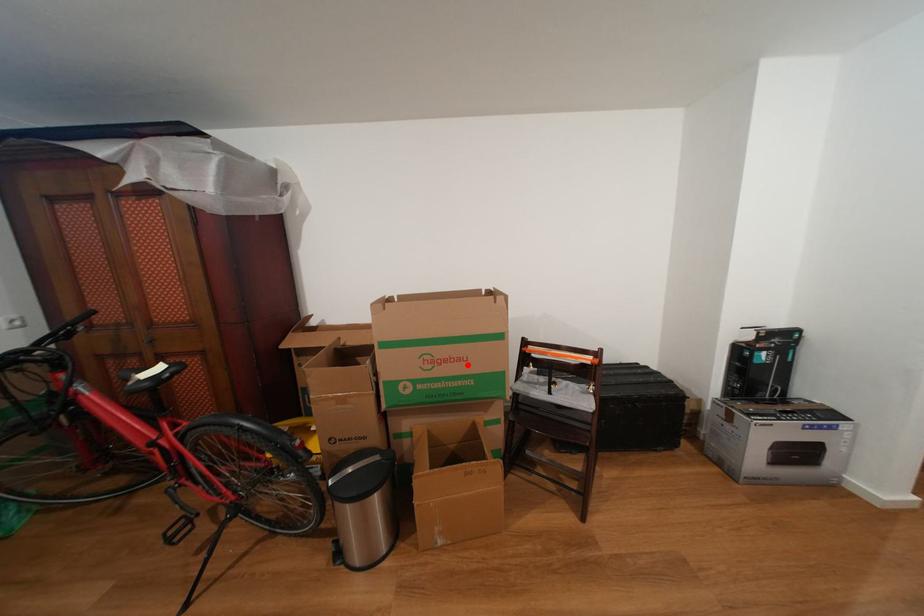
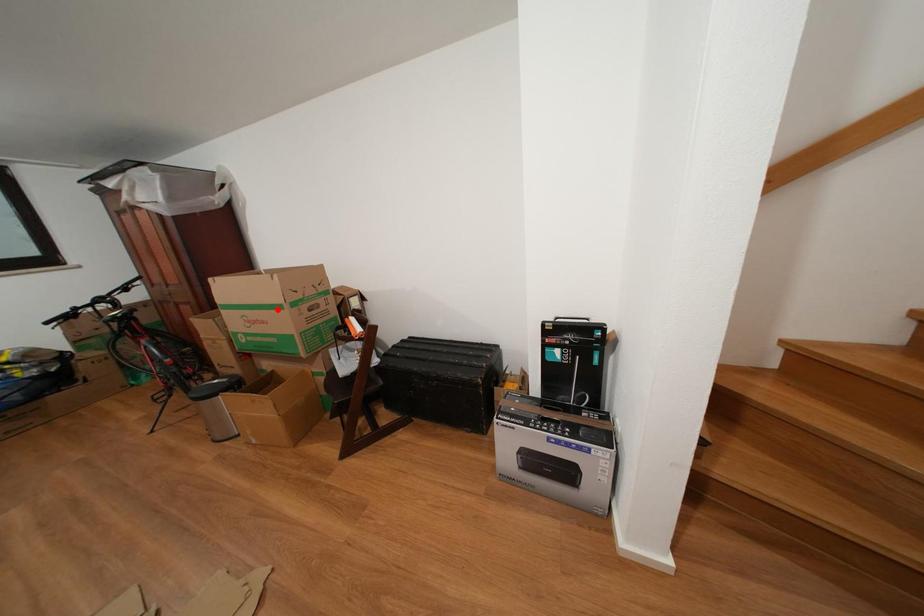
I am providing you with two images of the same scene from different viewpoints. A red point is marked on the first image and another point is marked on the second image. Do the highlighted points in image1 and image2 indicate the same real-world spot?

No